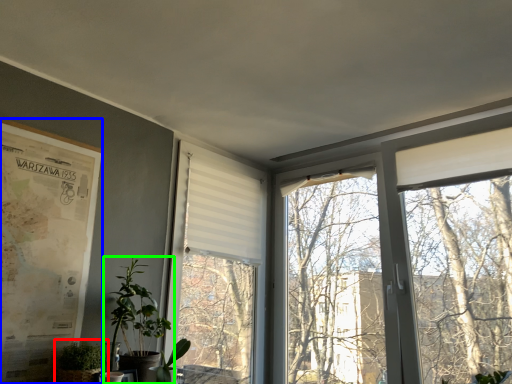
Question: Which object is positioned closest to houseplant (highlighted by a red box)? Select from poster page (highlighted by a blue box) and houseplant (highlighted by a green box).

Choices:
 (A) poster page
 (B) houseplant

Answer: (B)